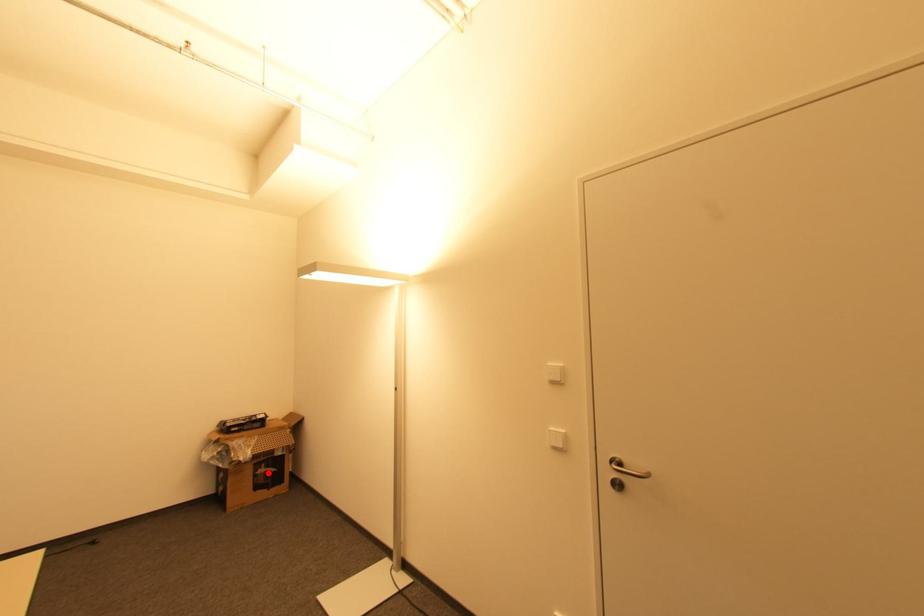
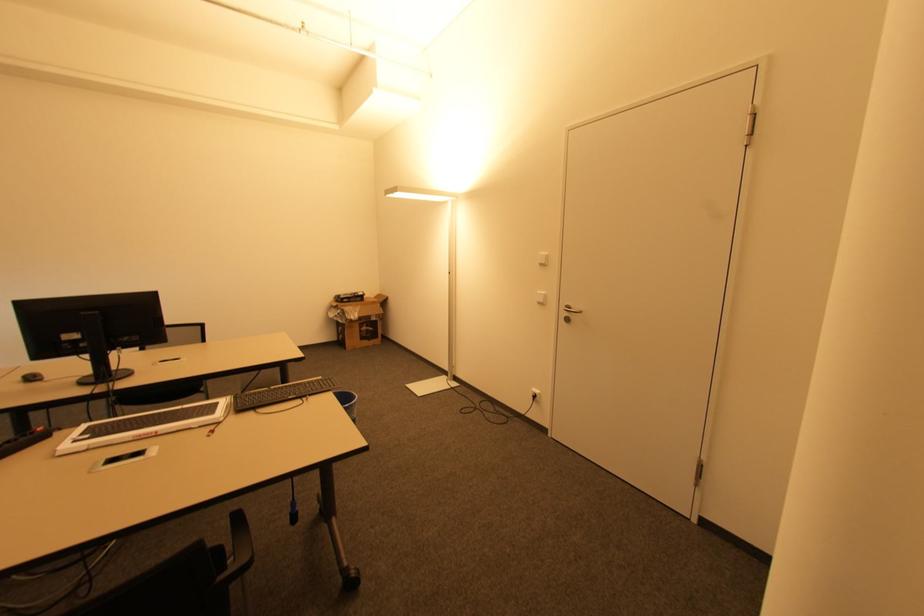
Question: I am providing you with two images of the same scene from different viewpoints. Given a red point in image1, look at the same physical point in image2. Is it:

Choices:
 (A) Closer to the viewpoint
 (B) Farther from the viewpoint

Answer: (A)